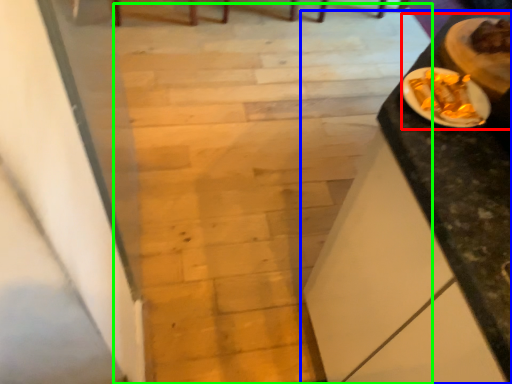
Question: Which is farther away from dinner (highlighted by a red box)? table (highlighted by a blue box) or stairwell (highlighted by a green box)?

Choices:
 (A) table
 (B) stairwell

Answer: (B)